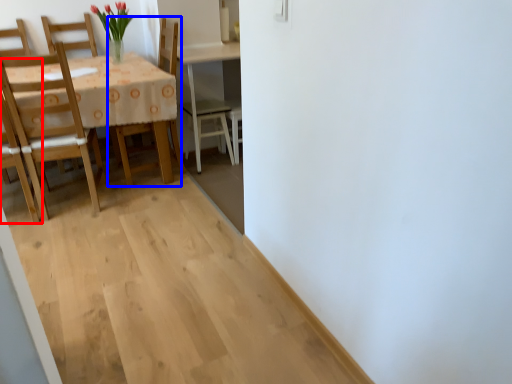
Question: Which object appears farthest to the camera in this image, chair (highlighted by a red box) or chair (highlighted by a blue box)?

Choices:
 (A) chair
 (B) chair

Answer: (B)